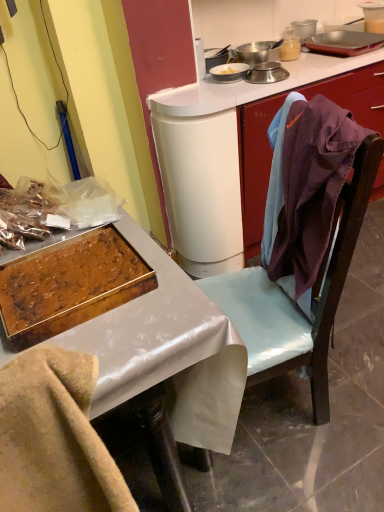
The image size is (384, 512). Find the location of `free area below purple fabric at right (from a real-world perspective)`. free area below purple fabric at right (from a real-world perspective) is located at coordinates (301, 400).